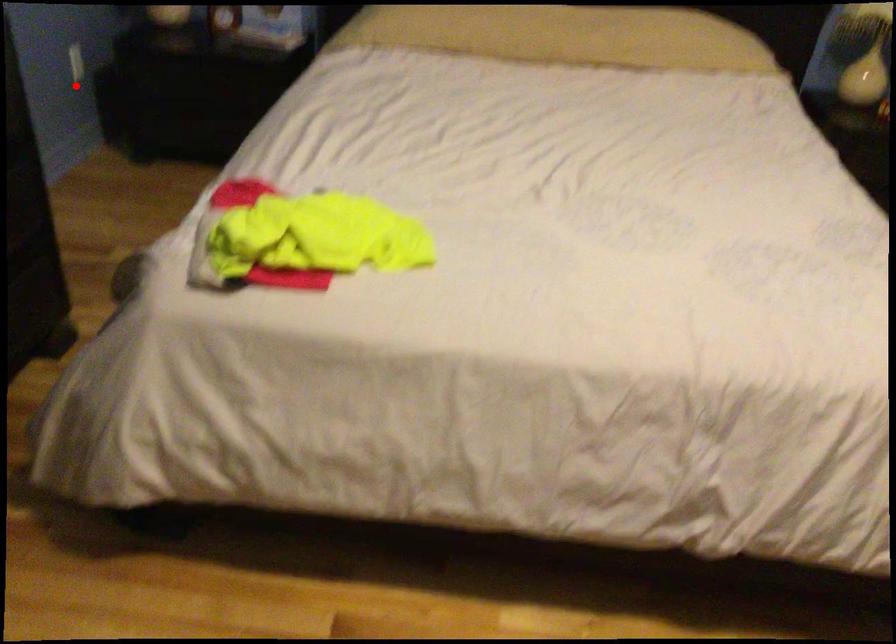
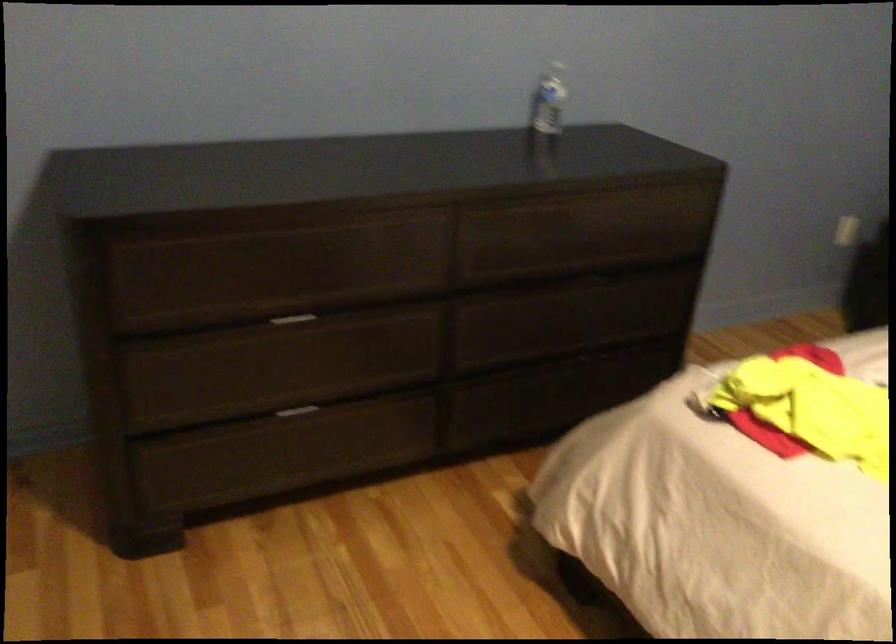
In the second image, find the point that corresponds to the highlighted location in the first image.

(848, 231)